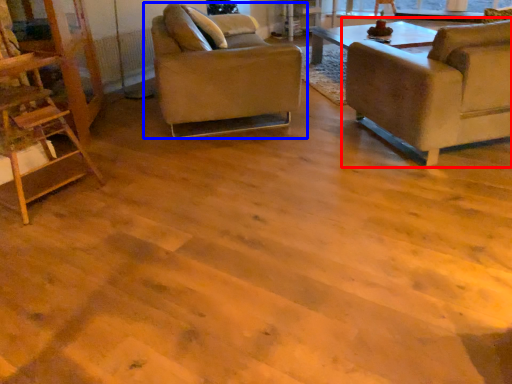
Question: Among these objects, which one is nearest to the camera, chair (highlighted by a red box) or chair (highlighted by a blue box)?

Choices:
 (A) chair
 (B) chair

Answer: (A)